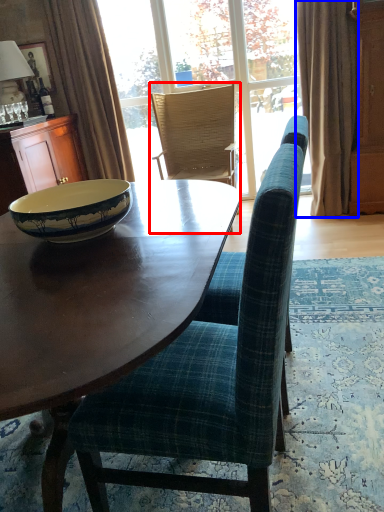
Question: Which object is closer to the camera taking this photo, chair (highlighted by a red box) or curtain (highlighted by a blue box)?

Choices:
 (A) chair
 (B) curtain

Answer: (B)